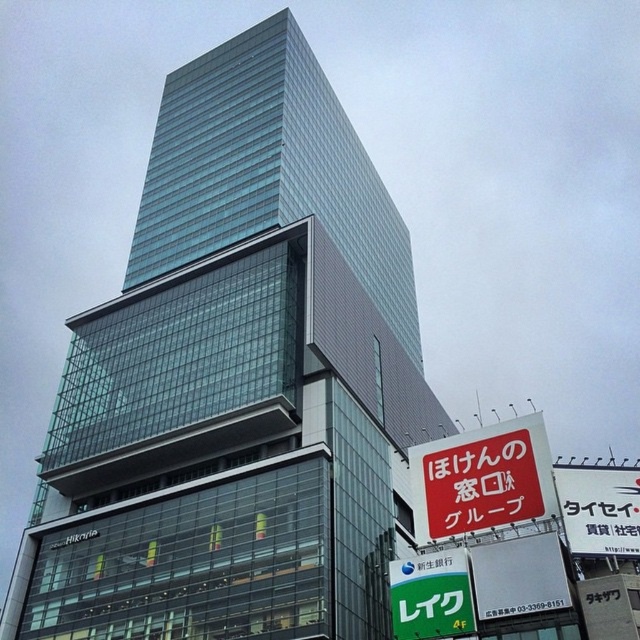
Is point (442, 461) less distant than point (460, 577)?

No, (442, 461) is behind (460, 577).

Which is below, red paper sign at lower right or green plastic sign at lower center?

green plastic sign at lower center is below.

Is point (522, 484) positioned after point (419, 582)?

That is True.

The width and height of the screenshot is (640, 640). Identify the location of red paper sign at lower right. [x=483, y=480].

Is transparent glass building at center above green plastic sign at lower center?

Indeed, transparent glass building at center is positioned over green plastic sign at lower center.

Can you confirm if transparent glass building at center is positioned below green plastic sign at lower center?

No.

Find the location of a particular element. The image size is (640, 640). transparent glass building at center is located at coordinates (236, 381).

Between transparent glass building at center and red paper sign at lower right, which one appears on the left side from the viewer's perspective?

Positioned to the left is transparent glass building at center.

Between point (188, 211) and point (474, 442), which one is positioned behind?

The point (188, 211) is more distant.

At what (x,y) coordinates should I click in order to perform the action: click on transparent glass building at center. Please return your answer as a coordinate pair (x, y). Looking at the image, I should click on tap(236, 381).

The height and width of the screenshot is (640, 640). Identify the location of transparent glass building at center. (236, 381).